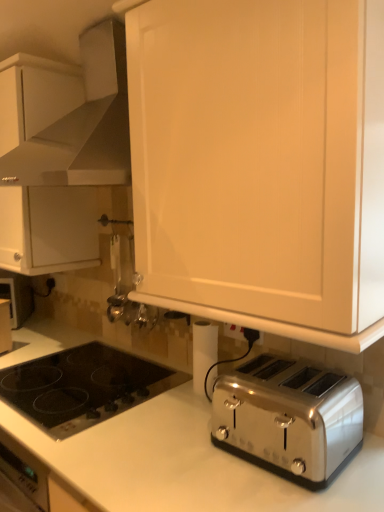
Question: Is white plastic electric outlet at lower center positioned behind white matte cabinet at upper left, the second cabinetry viewed from the right?

Choices:
 (A) yes
 (B) no

Answer: (B)

Question: From a real-world perspective, is white plastic electric outlet at lower center positioned under white matte cabinet at upper left, the second cabinetry viewed from the right, based on gravity?

Choices:
 (A) yes
 (B) no

Answer: (A)

Question: Is white plastic electric outlet at lower center smaller than white matte cabinet at upper left, placed as the 2th cabinetry when sorted from front to back?

Choices:
 (A) yes
 (B) no

Answer: (A)

Question: Is white plastic electric outlet at lower center closer to camera compared to white matte cabinet at upper left, placed as the 1th cabinetry when sorted from left to right?

Choices:
 (A) yes
 (B) no

Answer: (A)

Question: Would you say white plastic electric outlet at lower center is outside white matte cabinet at upper left, the second cabinetry viewed from the right?

Choices:
 (A) no
 (B) yes

Answer: (B)

Question: Is the surface of white plastic electric outlet at lower center in direct contact with white matte cabinet at upper left, the second cabinetry viewed from the right?

Choices:
 (A) yes
 (B) no

Answer: (B)

Question: Can you confirm if black glass cooktop at lower left is smaller than white matte cabinet at upper left, placed as the 2th cabinetry when sorted from front to back?

Choices:
 (A) yes
 (B) no

Answer: (A)

Question: Is black glass cooktop at lower left at the left side of white matte cabinet at upper left, placed as the 2th cabinetry when sorted from front to back?

Choices:
 (A) no
 (B) yes

Answer: (A)

Question: Is black glass cooktop at lower left next to white matte cabinet at upper left, which is the 1th cabinetry in back-to-front order, and touching it?

Choices:
 (A) no
 (B) yes

Answer: (A)

Question: Can you confirm if black glass cooktop at lower left is shorter than white matte cabinet at upper left, placed as the 1th cabinetry when sorted from left to right?

Choices:
 (A) yes
 (B) no

Answer: (A)

Question: From the image's perspective, is black glass cooktop at lower left located beneath white matte cabinet at upper left, placed as the 1th cabinetry when sorted from left to right?

Choices:
 (A) no
 (B) yes

Answer: (B)

Question: Does black glass cooktop at lower left turn towards white matte cabinet at upper left, which is the 1th cabinetry in back-to-front order?

Choices:
 (A) no
 (B) yes

Answer: (A)

Question: From a real-world perspective, does white plastic electric outlet at lower center sit lower than black glass cooktop at lower left?

Choices:
 (A) no
 (B) yes

Answer: (A)